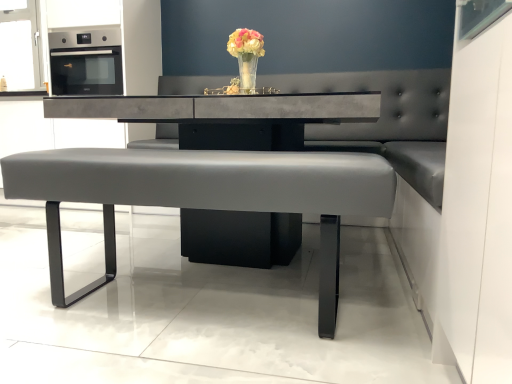
Question: Considering their positions, is translucent glass vase at center located in front of or behind matte gray bench at center?

Choices:
 (A) front
 (B) behind

Answer: (B)

Question: Is translucent glass vase at center inside the boundaries of matte gray bench at center, or outside?

Choices:
 (A) inside
 (B) outside

Answer: (B)

Question: Estimate the real-world distances between objects in this image. Which object is closer to the concrete table at center?

Choices:
 (A) satin black oven at upper left
 (B) translucent glass vase at center
 (C) matte gray bench at center

Answer: (C)

Question: Based on their relative distances, which object is farther from the translucent glass vase at center?

Choices:
 (A) concrete table at center
 (B) matte gray bench at center
 (C) satin black oven at upper left

Answer: (C)